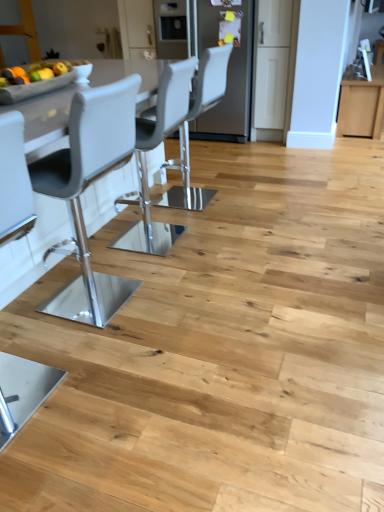
The image size is (384, 512). In order to click on vacant area that is in front of matte gray chair at center, acting as the second chair starting from the left in this screenshot , I will do `click(208, 226)`.